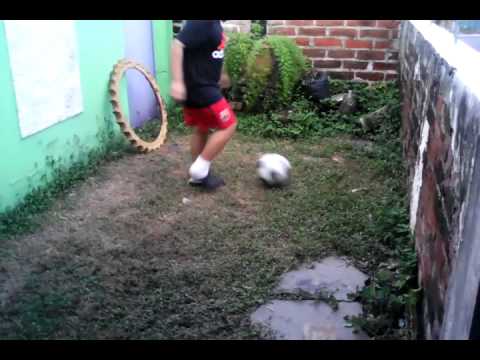
Identify the location of plant. The width and height of the screenshot is (480, 360). (394, 264).